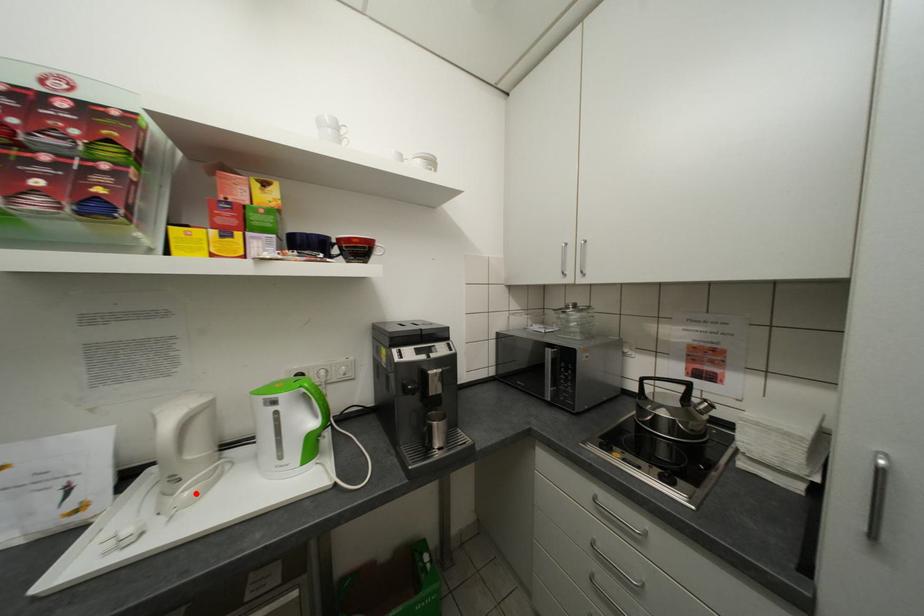
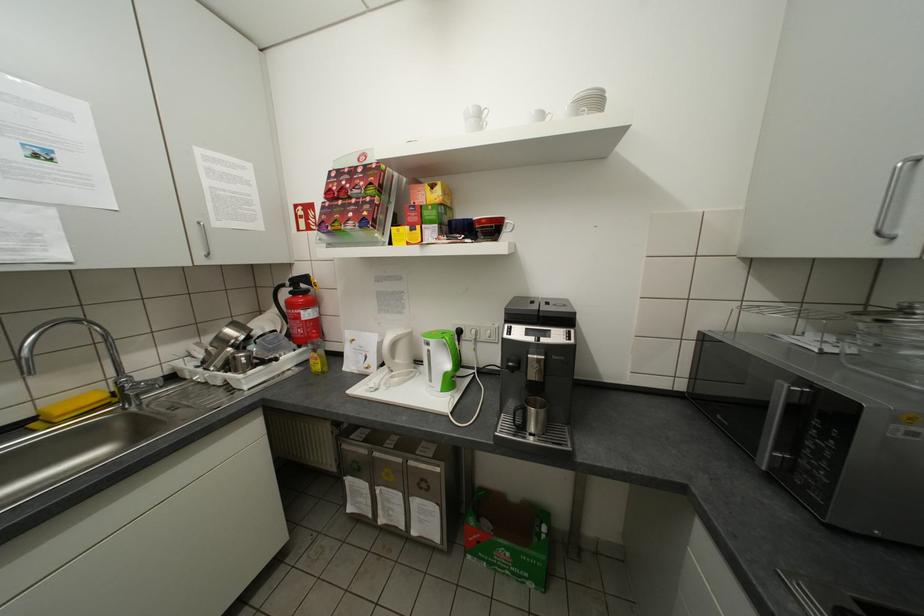
The point at the highlighted location is marked in the first image. Where is the corresponding point in the second image?

(406, 379)